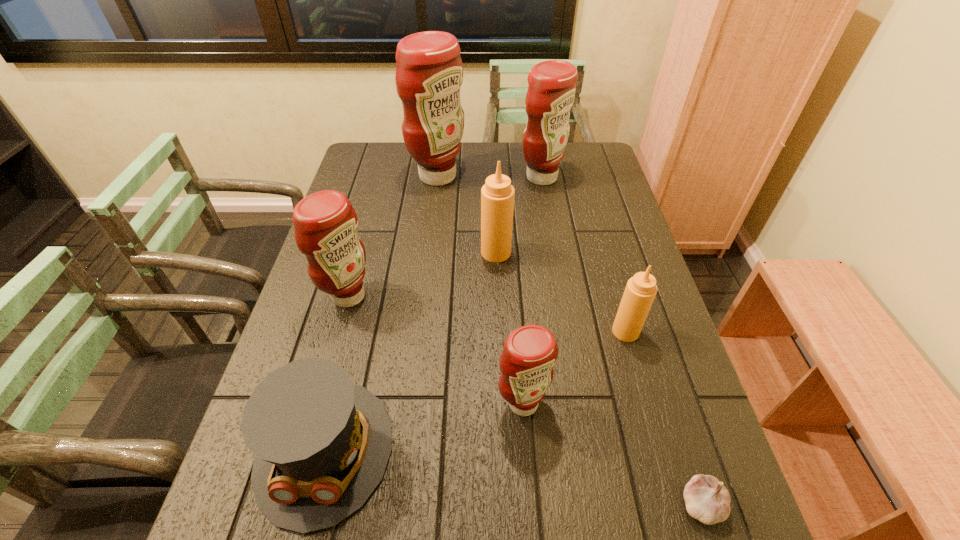
Find the location of a particular element. vacant space situated on the front of the rightmost condiment is located at coordinates (637, 375).

The image size is (960, 540). I want to click on vacant space located on the back of the white garlic, so click(652, 349).

Image resolution: width=960 pixels, height=540 pixels. In order to click on condiment that is at the left edge in this screenshot , I will do `click(325, 222)`.

Where is `dress hat that is at the left edge`? The height and width of the screenshot is (540, 960). dress hat that is at the left edge is located at coordinates (321, 444).

Where is `condiment positioned at the right edge`? The height and width of the screenshot is (540, 960). condiment positioned at the right edge is located at coordinates (641, 289).

The image size is (960, 540). I want to click on garlic that is at the right edge, so click(707, 499).

The height and width of the screenshot is (540, 960). In order to click on blank area at the left edge in this screenshot , I will do `click(312, 315)`.

Where is `vacant space at the right edge of the desktop`? Image resolution: width=960 pixels, height=540 pixels. vacant space at the right edge of the desktop is located at coordinates (616, 239).

In the image, there is a desktop. Identify the location of vacant space at the far left corner. (370, 154).

The height and width of the screenshot is (540, 960). What are the coordinates of `free space at the near left corner of the desktop` in the screenshot? It's located at (296, 539).